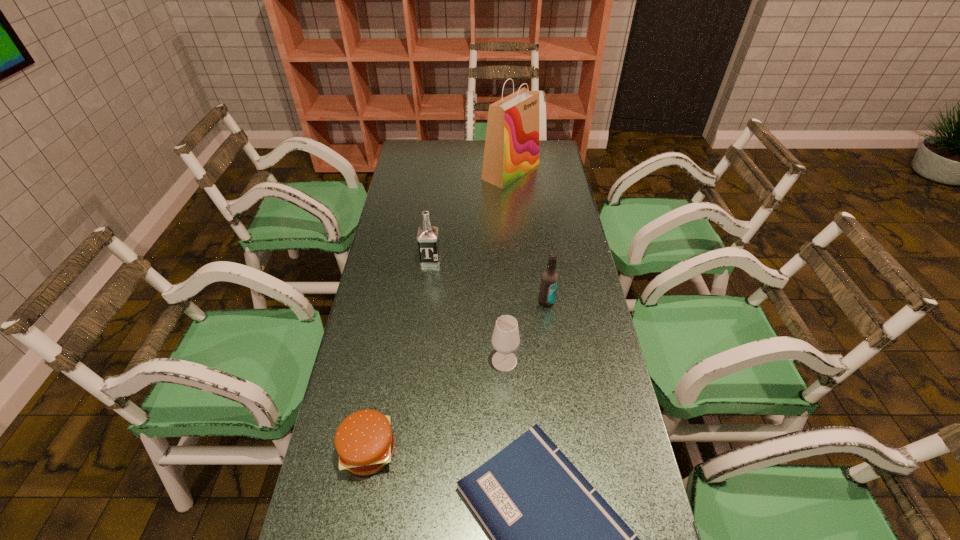
I want to click on the fifth closest object to the vodka, so click(555, 539).